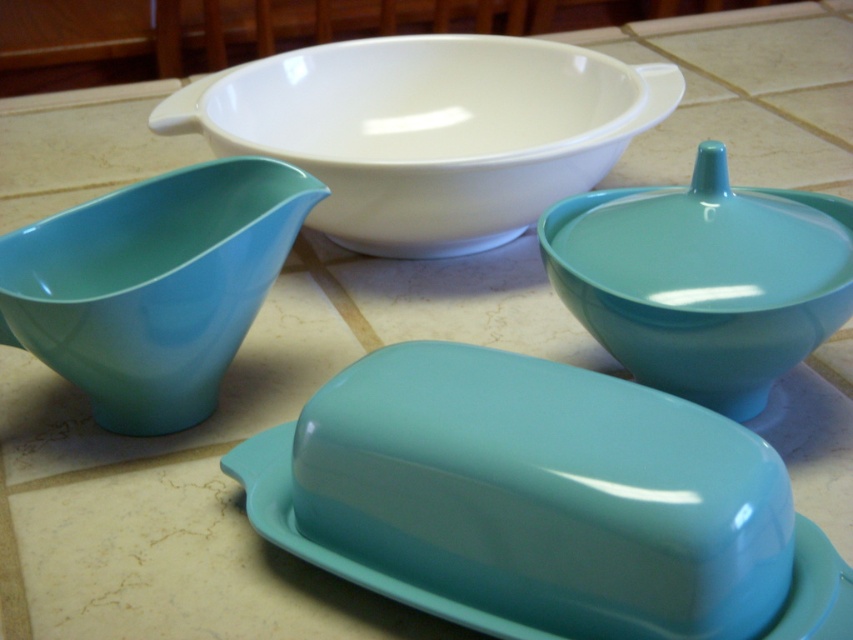
You are a chef trying to arrange ingredients on the countertop. You have two points marked on the tiles where you need to place a spice jar and a salt shaker. The points are labeled as point 1 at coordinates (440, 109) and point 2 at coordinates (579, 280). Based on their positions, which point is closer to you as you stand in front of the countertop?

Point 1 at coordinates (440, 109) is closer to you because it is further to the viewer than point 2 at coordinates (579, 280).